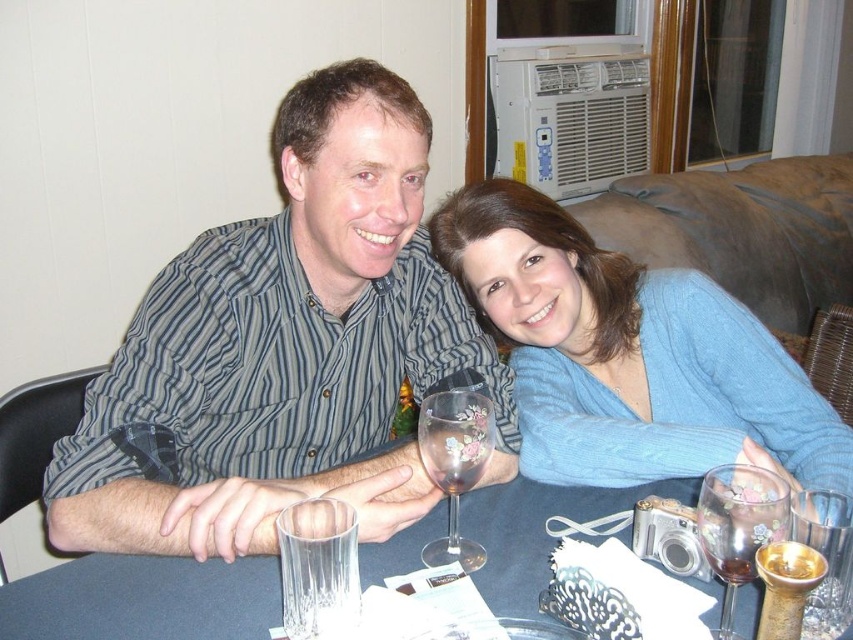
Based on the photo, does blue knitted sweater at upper right appear over clear glass table at center?

Correct, blue knitted sweater at upper right is located above clear glass table at center.

In the scene shown: How much distance is there between blue knitted sweater at upper right and clear glass table at center?

A distance of 23.41 centimeters exists between blue knitted sweater at upper right and clear glass table at center.

Image resolution: width=853 pixels, height=640 pixels. Describe the element at coordinates (628, 355) in the screenshot. I see `blue knitted sweater at upper right` at that location.

Find the location of `blue knitted sweater at upper right`. blue knitted sweater at upper right is located at coordinates (628, 355).

Does clear glass table at center appear on the right side of transparent glass wine glass at lower right?

No, clear glass table at center is not to the right of transparent glass wine glass at lower right.

What do you see at coordinates (143, 600) in the screenshot?
I see `clear glass table at center` at bounding box center [143, 600].

The image size is (853, 640). Find the location of `clear glass table at center`. clear glass table at center is located at coordinates (143, 600).

Does clear glass table at center have a lesser width compared to translucent glass wine glass at lower right?

Incorrect, clear glass table at center's width is not less than translucent glass wine glass at lower right's.

This screenshot has width=853, height=640. I want to click on clear glass table at center, so click(x=143, y=600).